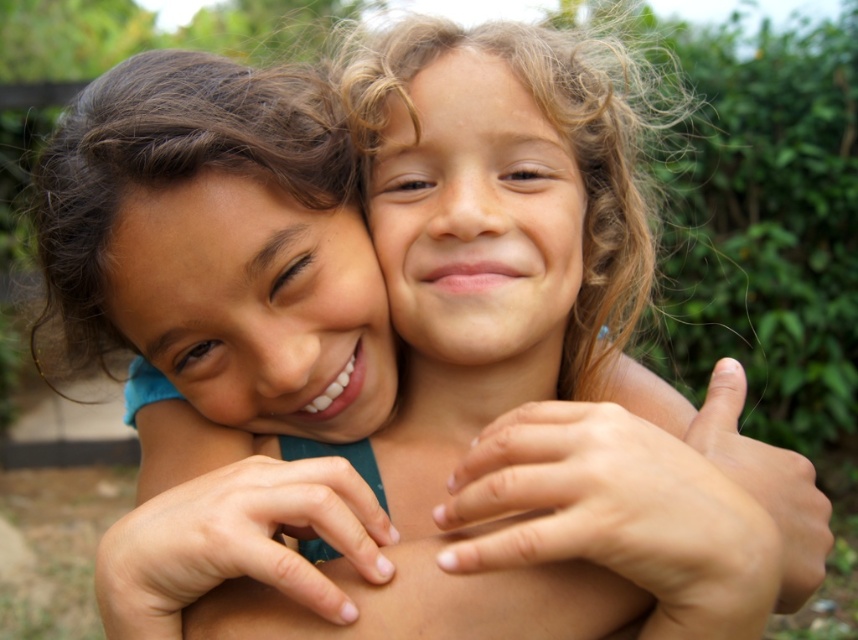
Question: Is smooth skin face at center above curly hair at center?

Choices:
 (A) yes
 (B) no

Answer: (B)

Question: Observing the image, what is the correct spatial positioning of smooth skin face at center in reference to curly hair at center?

Choices:
 (A) left
 (B) right

Answer: (A)

Question: Which of the following is the closest to the observer?

Choices:
 (A) smooth skin face at center
 (B) curly hair at center

Answer: (A)

Question: Does smooth skin face at center appear on the right side of curly hair at center?

Choices:
 (A) yes
 (B) no

Answer: (B)

Question: Which object is farther from the camera taking this photo?

Choices:
 (A) smooth skin face at center
 (B) curly hair at center

Answer: (B)